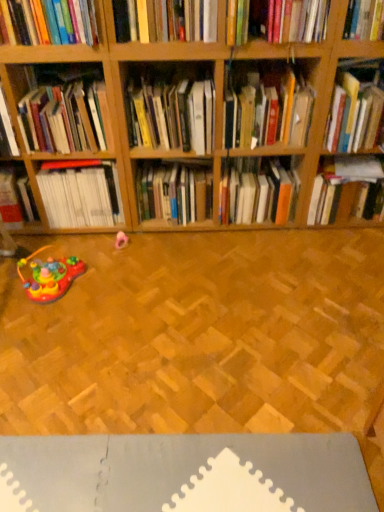
Identify the location of free space in front of pink rubber duck at center, the second toy from the left. (123, 267).